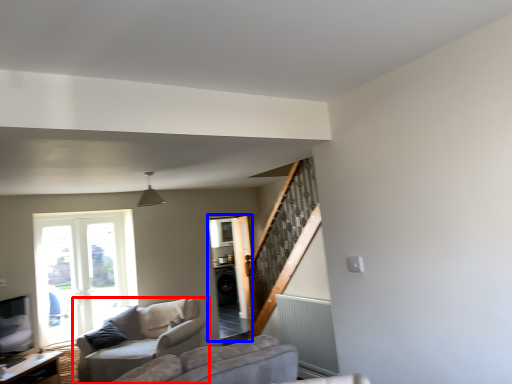
Question: Which point is closer to the camera, studio couch (highlighted by a red box) or screen door (highlighted by a blue box)?

Choices:
 (A) studio couch
 (B) screen door

Answer: (A)